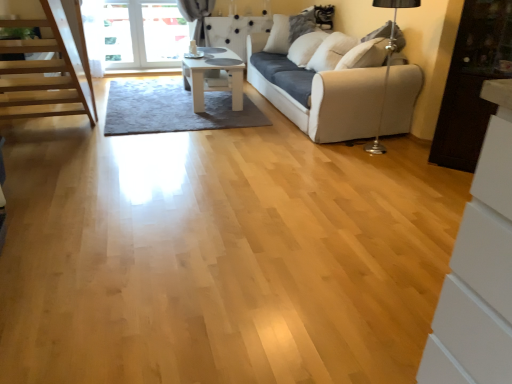
Question: Considering the positions of white glossy table at center and white soft pillow at upper center in the image, is white glossy table at center taller or shorter than white soft pillow at upper center?

Choices:
 (A) short
 (B) tall

Answer: (A)

Question: Is white glossy table at center bigger or smaller than white soft pillow at upper center?

Choices:
 (A) small
 (B) big

Answer: (B)

Question: Considering the real-world distances, which object is farthest from the white glossy table at center?

Choices:
 (A) dark wood cabinet at right
 (B) white soft pillow at upper center
 (C) white fabric couch at center

Answer: (A)

Question: Considering the real-world distances, which object is farthest from the white glossy table at center?

Choices:
 (A) dark wood cabinet at right
 (B) white fabric couch at center
 (C) white soft pillow at upper center

Answer: (A)